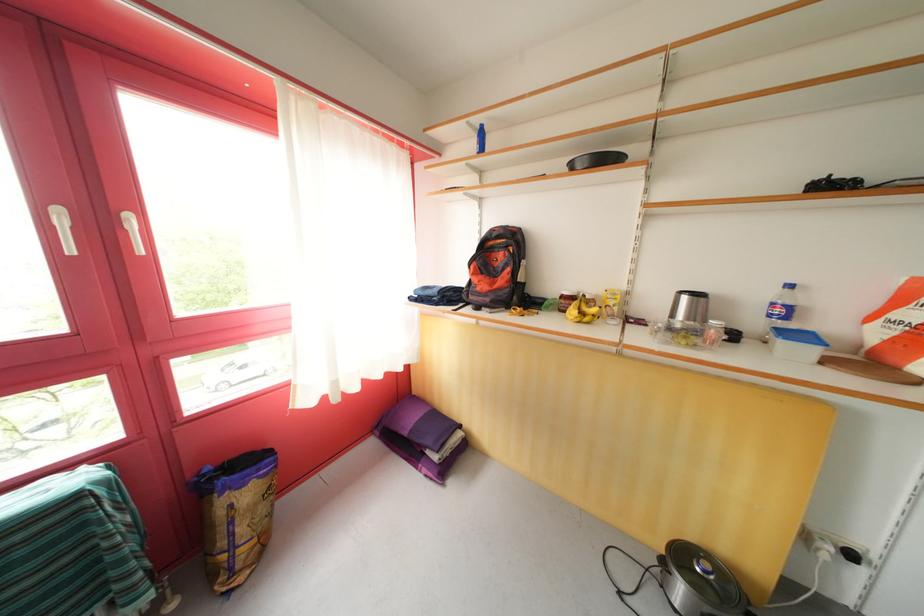
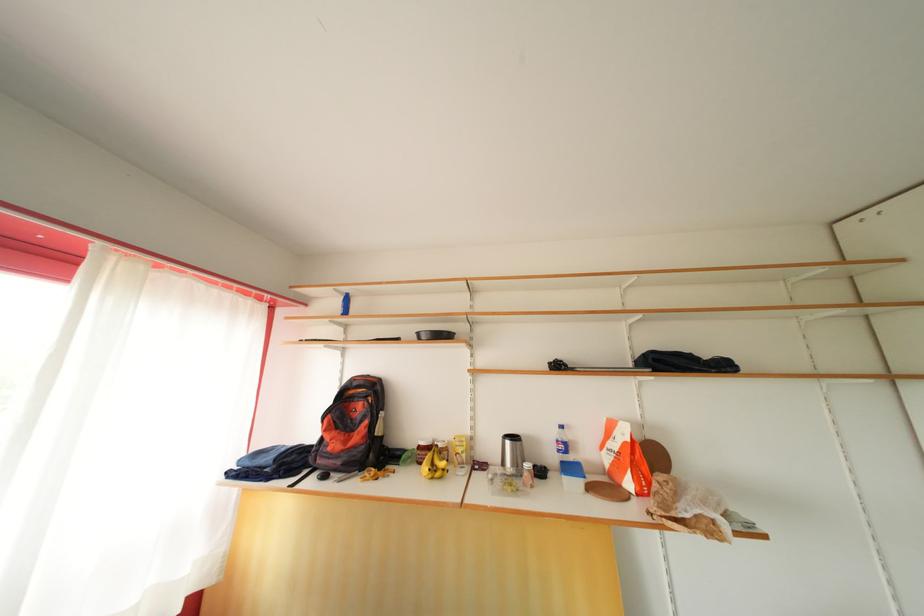
The point at (584, 309) is marked in the first image. Where is the corresponding point in the second image?

(436, 461)